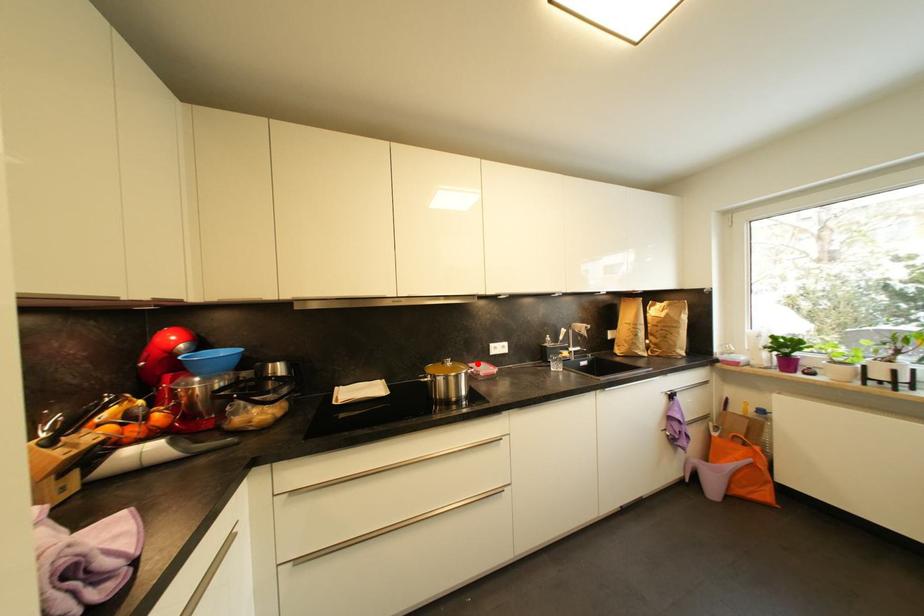
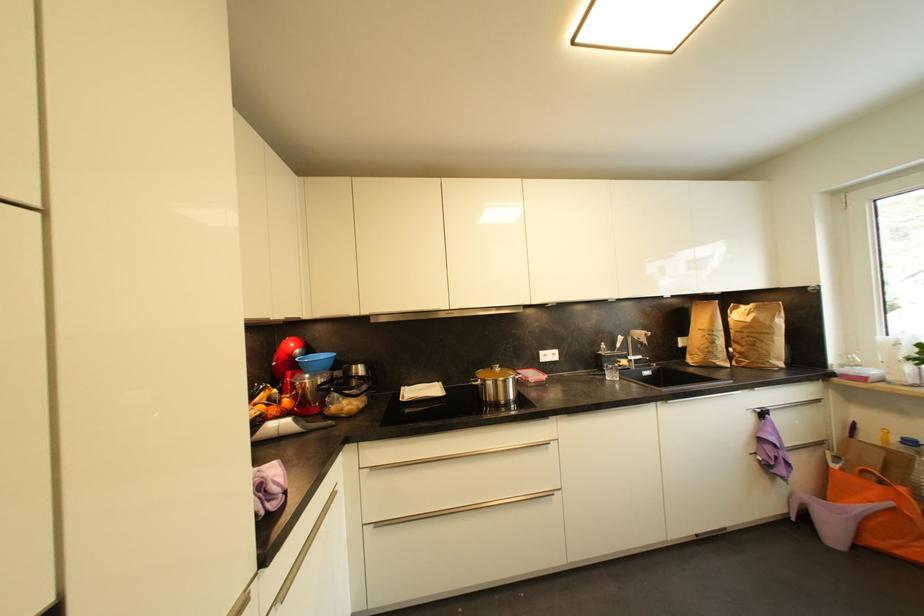
In the second image, find the point that corresponds to the highlighted location in the first image.

(528, 371)